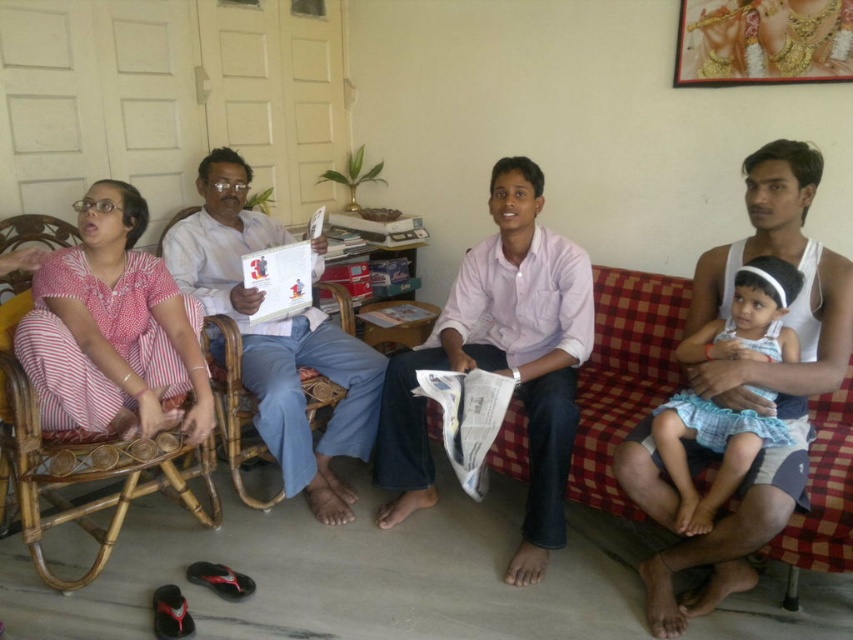
Who is more distant from viewer, (49, 300) or (685, 340)?

The point (49, 300) is behind.

Is pink striped dress at left thinner than light blue cotton dress at right?

In fact, pink striped dress at left might be wider than light blue cotton dress at right.

Who is more forward, (138,385) or (717,435)?

Point (717,435)

Where is `pink striped dress at left`? This screenshot has width=853, height=640. pink striped dress at left is located at coordinates (112, 330).

Who is higher up, white paper book at center or light blue cotton dress at right?

white paper book at center is higher up.

Between point (287, 385) and point (743, 291), which one is positioned in front?

Positioned in front is point (743, 291).

The height and width of the screenshot is (640, 853). What do you see at coordinates (276, 339) in the screenshot? I see `white paper book at center` at bounding box center [276, 339].

Find the location of `white paper book at center`. white paper book at center is located at coordinates (276, 339).

From the picture: Does pink striped dress at left appear over white paper book at center?

Yes, pink striped dress at left is above white paper book at center.

Does pink striped dress at left have a greater width compared to white paper book at center?

No.

Locate an element on the screen. The image size is (853, 640). pink striped dress at left is located at coordinates (112, 330).